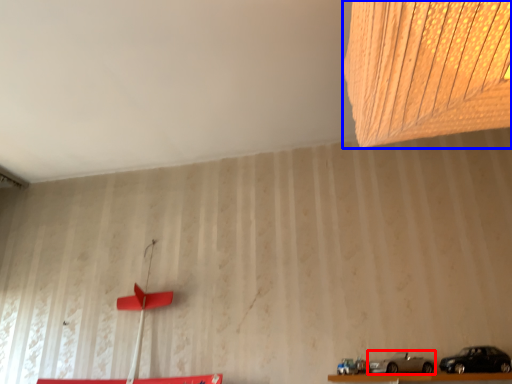
Question: Which object is closer to the camera taking this photo, car (highlighted by a red box) or lamp (highlighted by a blue box)?

Choices:
 (A) car
 (B) lamp

Answer: (B)